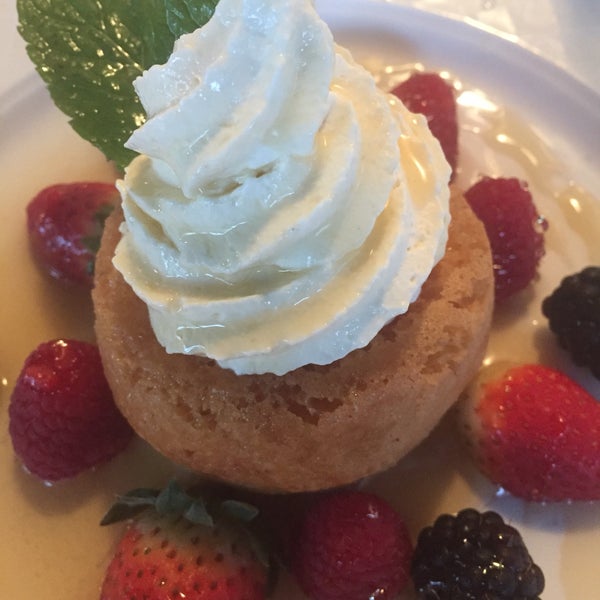
Find the location of `plate`. plate is located at coordinates (524, 328).